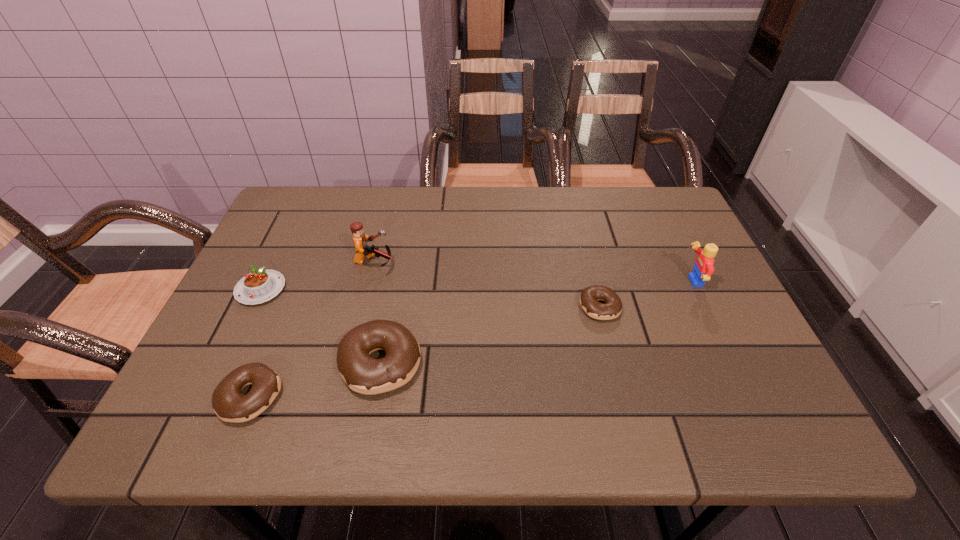
At what (x,y) coordinates should I click in order to perform the action: click on vacant position for inserting another doughnut evenly. Please return your answer as a coordinate pair (x, y). Looking at the image, I should click on (496, 333).